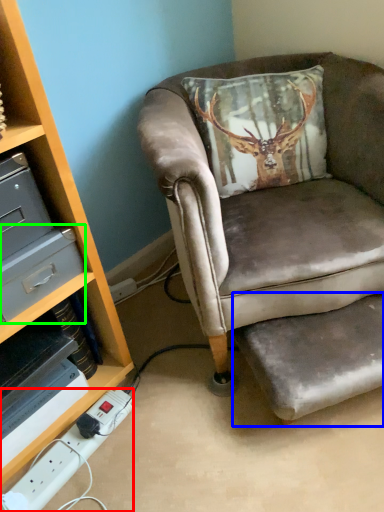
Question: Which object is the closest to the power outlet (highlighted by a red box)? Choose among these: footrest (highlighted by a blue box) or drawer (highlighted by a green box).

Choices:
 (A) footrest
 (B) drawer

Answer: (B)